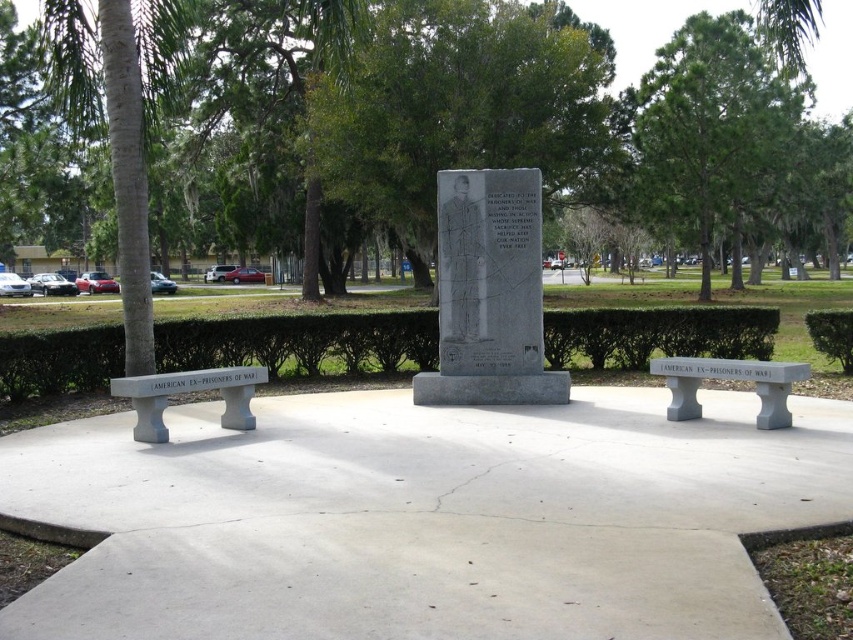
Question: Which point is farther to the camera?

Choices:
 (A) (200, 381)
 (B) (819, 461)
 (C) (585, 336)

Answer: (C)

Question: In this image, where is green hedge at center located relative to green leafy tree at center?

Choices:
 (A) below
 (B) above

Answer: (A)

Question: Which point is closer to the camera taking this photo?

Choices:
 (A) (234, 371)
 (B) (766, 420)
 (C) (474, 353)
 (D) (663, 3)

Answer: (B)

Question: Estimate the real-world distances between objects in this image. Which object is farther from the gray concrete bench at left?

Choices:
 (A) green hedge at center
 (B) gray concrete bench at lower right
 (C) gray concrete bench at center

Answer: (C)

Question: Is gray concrete bench at center to the left of gray concrete bench at left from the viewer's perspective?

Choices:
 (A) yes
 (B) no

Answer: (B)

Question: Is gray concrete bench at left below gray concrete bench at lower right?

Choices:
 (A) no
 (B) yes

Answer: (B)